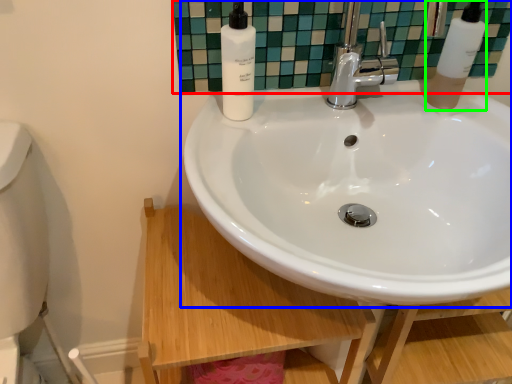
Question: Which object is positioned farthest from mirror (highlighted by a red box)? Select from sink (highlighted by a blue box) and soap dispenser (highlighted by a green box).

Choices:
 (A) sink
 (B) soap dispenser

Answer: (A)